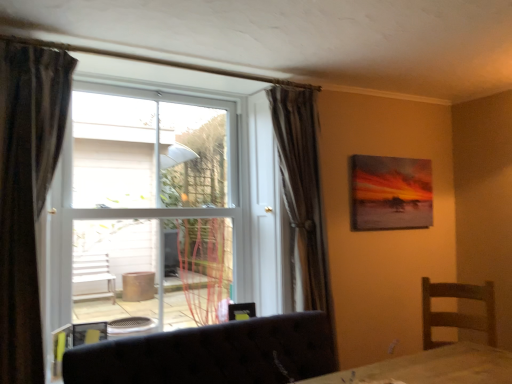
Question: Is dark fabric curtain at left, which ranks as the first curtain in left-to-right order, located outside white plastic window at center?

Choices:
 (A) yes
 (B) no

Answer: (A)

Question: Is dark fabric curtain at left, the second curtain from the back, facing towards white plastic window at center?

Choices:
 (A) yes
 (B) no

Answer: (B)

Question: Does dark fabric curtain at left, the second curtain from the back, have a smaller size compared to white plastic window at center?

Choices:
 (A) yes
 (B) no

Answer: (A)

Question: Is white plastic window at center inside dark fabric curtain at left, which ranks as the first curtain in left-to-right order?

Choices:
 (A) no
 (B) yes

Answer: (A)

Question: Is dark fabric curtain at left, the second curtain from the back, turned away from white plastic window at center?

Choices:
 (A) no
 (B) yes

Answer: (A)

Question: Can you confirm if dark fabric curtain at left, which ranks as the first curtain in left-to-right order, is thinner than white plastic window at center?

Choices:
 (A) yes
 (B) no

Answer: (A)

Question: Is white plastic window at center positioned behind dark fabric couch at lower center?

Choices:
 (A) no
 (B) yes

Answer: (B)

Question: Considering the relative sizes of white plastic window at center and dark fabric couch at lower center in the image provided, is white plastic window at center bigger than dark fabric couch at lower center?

Choices:
 (A) no
 (B) yes

Answer: (B)

Question: Considering the relative sizes of white plastic window at center and dark fabric couch at lower center in the image provided, is white plastic window at center shorter than dark fabric couch at lower center?

Choices:
 (A) no
 (B) yes

Answer: (A)

Question: From a real-world perspective, is white plastic window at center beneath dark fabric couch at lower center?

Choices:
 (A) yes
 (B) no

Answer: (B)

Question: Could you tell me if white plastic window at center is facing dark fabric couch at lower center?

Choices:
 (A) no
 (B) yes

Answer: (B)

Question: From the image's perspective, is white plastic window at center on top of dark fabric couch at lower center?

Choices:
 (A) yes
 (B) no

Answer: (A)

Question: Does silky brown curtain at center, which is counted as the 2th curtain, starting from the front, lie in front of dark fabric curtain at left, which ranks as the first curtain in left-to-right order?

Choices:
 (A) yes
 (B) no

Answer: (B)